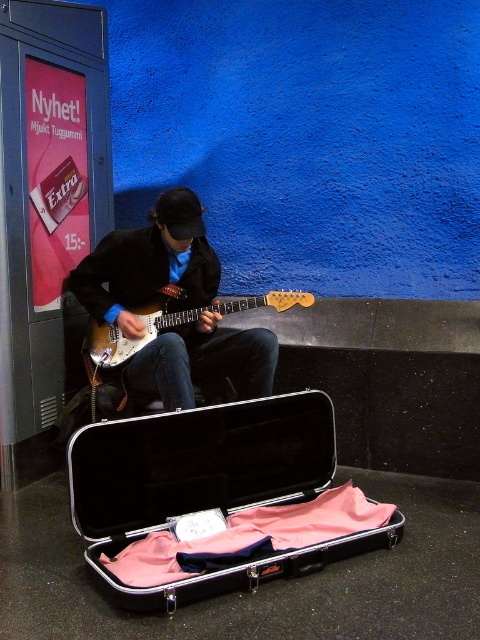
Question: Can you confirm if matte black guitar at center is positioned above sunburst wood electric guitar at center?

Choices:
 (A) yes
 (B) no

Answer: (A)

Question: Is metallic black case at lower center smaller than sunburst wood electric guitar at center?

Choices:
 (A) yes
 (B) no

Answer: (B)

Question: Which of the following is the closest to the observer?

Choices:
 (A) (204, 364)
 (B) (143, 316)

Answer: (B)

Question: Does metallic black case at lower center have a larger size compared to sunburst wood electric guitar at center?

Choices:
 (A) yes
 (B) no

Answer: (A)

Question: Which of the following is the closest to the observer?

Choices:
 (A) sunburst wood electric guitar at center
 (B) matte black guitar at center

Answer: (B)

Question: Estimate the real-world distances between objects in this image. Which object is farther from the metallic black case at lower center?

Choices:
 (A) sunburst wood electric guitar at center
 (B) matte black guitar at center

Answer: (A)